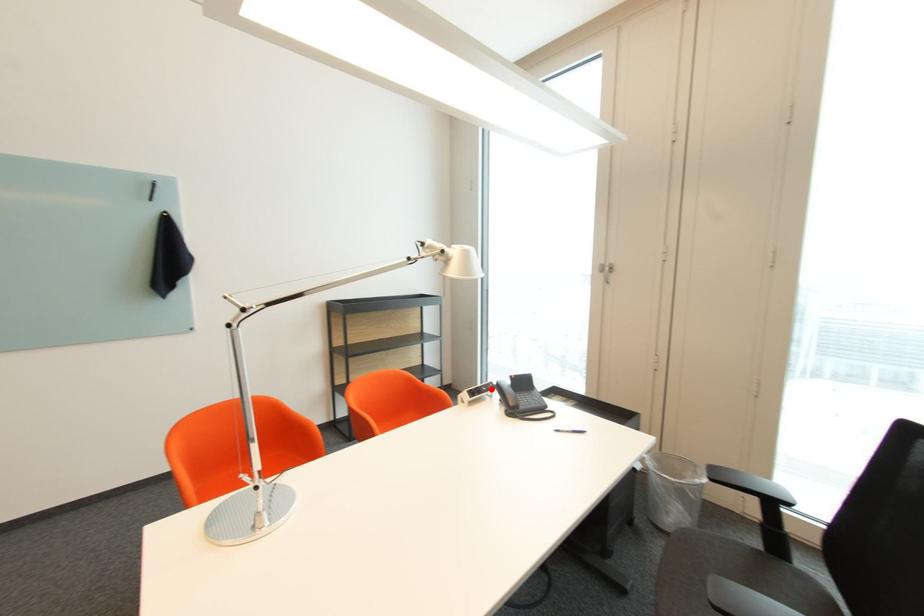
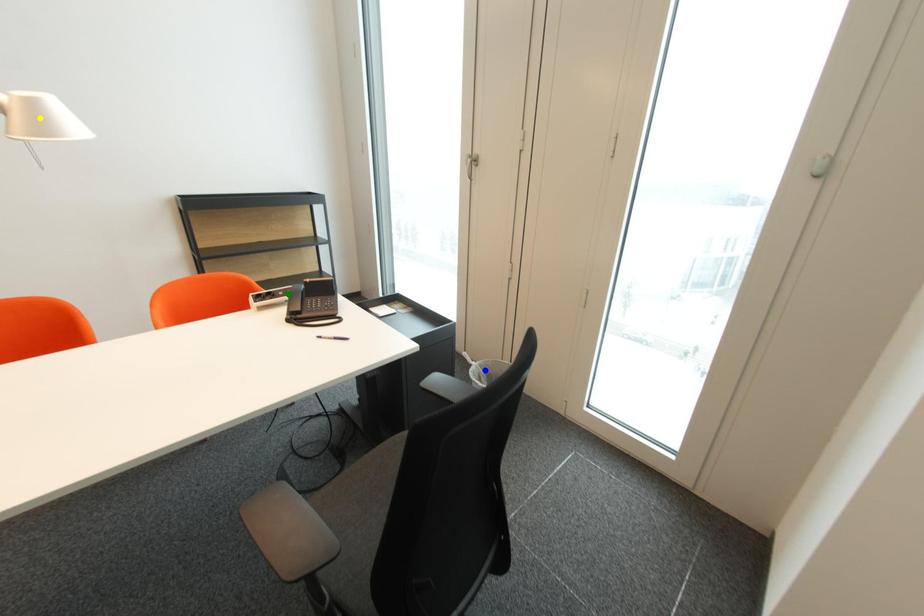
Question: I am providing you with two images of the same scene from different viewpoints. A red point is marked on the first image. You are given multiple points on the second image. Which point in image 2 represents the same 3d spot as the red point in image 1?

Choices:
 (A) yellow point
 (B) blue point
 (C) green point

Answer: (C)